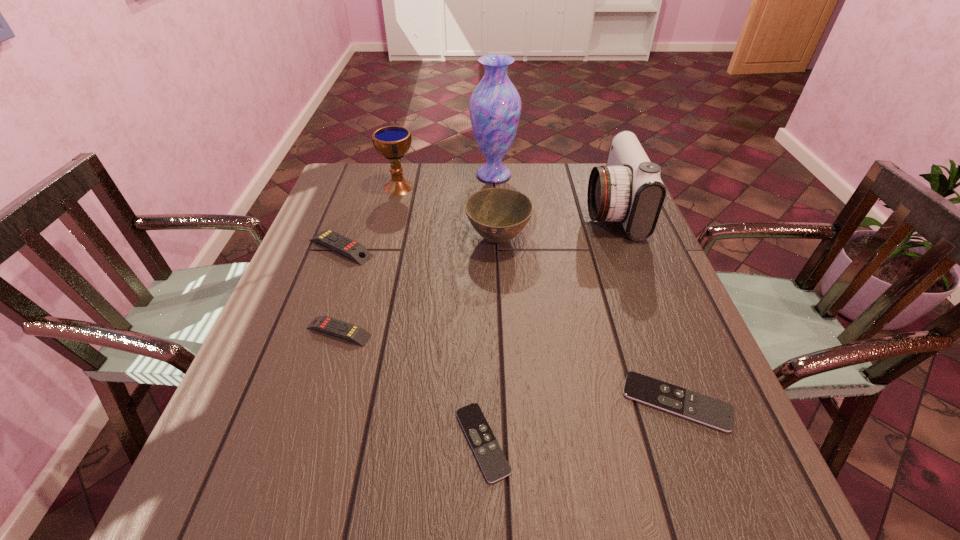
Locate an element on the screen. Image resolution: width=960 pixels, height=540 pixels. the tallest object is located at coordinates (495, 105).

The image size is (960, 540). Identify the location of vase. (495, 105).

Where is `camcorder`? The height and width of the screenshot is (540, 960). camcorder is located at coordinates [628, 189].

Image resolution: width=960 pixels, height=540 pixels. Find the location of `blue chalice`. blue chalice is located at coordinates (392, 142).

At what (x,y) coordinates should I click in order to perform the action: click on the fifth shortest object. Please return your answer as a coordinate pair (x, y). Looking at the image, I should click on (498, 214).

Locate an element on the screen. the bigger yellow remote control is located at coordinates (357, 252).

I want to click on the tallest remote control, so click(357, 252).

At what (x,y) coordinates should I click in order to perform the action: click on the nearer yellow remote control. Please return your answer as a coordinate pair (x, y). The height and width of the screenshot is (540, 960). Looking at the image, I should click on (354, 333).

Locate an element on the screen. the third nearest remote control is located at coordinates (354, 333).

Where is `the third tallest remote control`? the third tallest remote control is located at coordinates (706, 410).